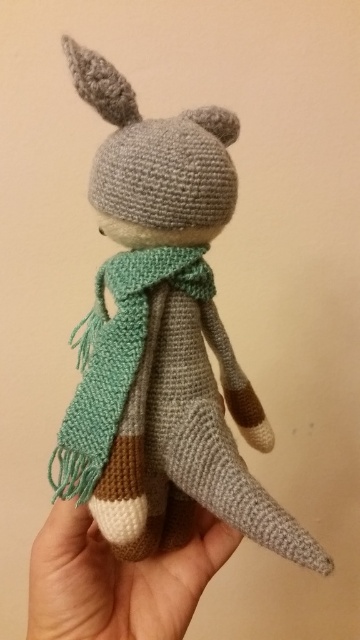
Can you confirm if gray yarn toy at center is wider than green knitted scarf at center?

Indeed, gray yarn toy at center has a greater width compared to green knitted scarf at center.

Does gray yarn toy at center appear under green knitted scarf at center?

Actually, gray yarn toy at center is above green knitted scarf at center.

The height and width of the screenshot is (640, 360). I want to click on gray yarn toy at center, so coord(163,339).

Find the location of `gray yarn toy at center`. gray yarn toy at center is located at coordinates (163, 339).

The image size is (360, 640). What are the coordinates of `gray yarn toy at center` in the screenshot? It's located at (163, 339).

At what (x,y) coordinates should I click in order to perform the action: click on gray yarn toy at center. Please return your answer as a coordinate pair (x, y). Looking at the image, I should click on (163, 339).

Image resolution: width=360 pixels, height=640 pixels. Identify the location of gray yarn toy at center. (163, 339).

Which is behind, point (149, 561) or point (200, 292)?

Point (149, 561)

Who is taller, white soft hand at lower center or green knitted scarf at center?

green knitted scarf at center is taller.

I want to click on white soft hand at lower center, so click(118, 579).